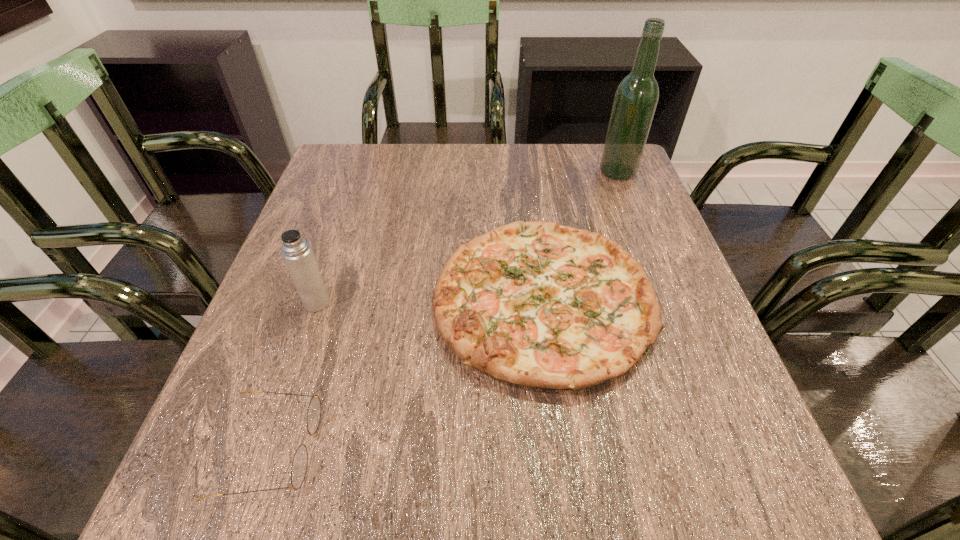
The image size is (960, 540). Identify the location of free point between the farthest object and the thermos bottle. (468, 237).

Where is `vacant space that's between the third shortest object and the pizza`? The width and height of the screenshot is (960, 540). vacant space that's between the third shortest object and the pizza is located at coordinates (429, 301).

Identify the location of vacant space in between the second tallest object and the tallest object. (468, 237).

Locate an element on the screen. The height and width of the screenshot is (540, 960). free space between the liquor and the second tallest object is located at coordinates (468, 237).

You are a GUI agent. You are given a task and a screenshot of the screen. Output one action in this format:
    pyautogui.click(x=<x>, y=<y>)
    Task: Click on the object that is the closest to the tallest object
    The height and width of the screenshot is (540, 960).
    Given the screenshot: What is the action you would take?
    pyautogui.click(x=537, y=304)

I want to click on object that ranks as the second closest to the tallest object, so click(297, 253).

Where is `free spot that satisfies the following two spatial constraints: 1. on the front side of the liquor; 2. on the temples of the spectacles`? Image resolution: width=960 pixels, height=540 pixels. free spot that satisfies the following two spatial constraints: 1. on the front side of the liquor; 2. on the temples of the spectacles is located at coordinates (726, 448).

Locate an element on the screen. vacant area in the image that satisfies the following two spatial constraints: 1. on the back side of the thermos bottle; 2. on the left side of the pizza is located at coordinates (318, 300).

Image resolution: width=960 pixels, height=540 pixels. Identify the location of vacant space that satisfies the following two spatial constraints: 1. on the back side of the thermos bottle; 2. on the right side of the farthest object. (361, 172).